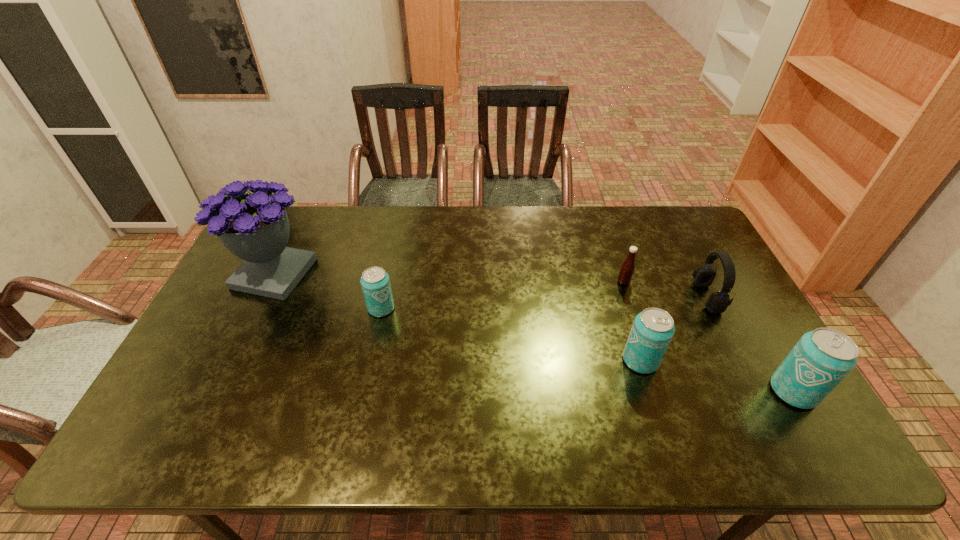
Locate an element on the screen. free space located on the left of the rightmost object is located at coordinates (659, 391).

This screenshot has height=540, width=960. Identify the location of vacant position located 0.140m on the headband of the headset. (650, 297).

This screenshot has width=960, height=540. What are the coordinates of `vacant space situated on the headband of the headset` in the screenshot? It's located at (600, 297).

Find the location of a particular element. free space located 0.090m on the headband of the headset is located at coordinates (666, 297).

The height and width of the screenshot is (540, 960). What are the coordinates of `vacant space located 0.090m on the right of the bouquet` in the screenshot? It's located at (344, 273).

Find the location of `vacant region located on the back of the Tabasco sauce`. vacant region located on the back of the Tabasco sauce is located at coordinates (610, 239).

At what (x,y) coordinates should I click in order to perform the action: click on object that is at the far edge. Please return your answer as a coordinate pair (x, y). Looking at the image, I should click on (255, 227).

Where is `object situated at the near edge`? object situated at the near edge is located at coordinates (821, 359).

You are a GUI agent. You are given a task and a screenshot of the screen. Output one action in this format:
    pyautogui.click(x=<x>, y=<y>)
    Task: Click on the object positioned at the left edge
    The width and height of the screenshot is (960, 540).
    Given the screenshot: What is the action you would take?
    255,227

Locate an element on the screen. The image size is (960, 540). beer can that is at the right edge is located at coordinates (821, 359).